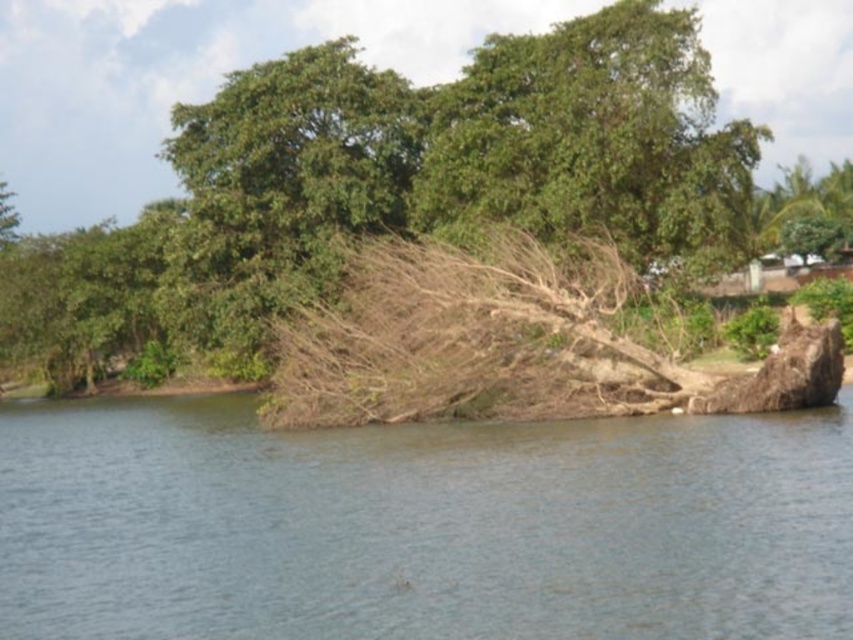
Does brown/dry wood tree at center have a smaller size compared to green leafy tree at upper right?

Incorrect, brown/dry wood tree at center is not smaller in size than green leafy tree at upper right.

Consider the image. Does brown/dry wood tree at center have a lesser height compared to green leafy tree at upper right?

→ No, brown/dry wood tree at center is not shorter than green leafy tree at upper right.

Between point (323, 74) and point (838, 166), which one is positioned in front?

Point (323, 74) is more forward.

Where is `brown/dry wood tree at center`? The height and width of the screenshot is (640, 853). brown/dry wood tree at center is located at coordinates (389, 189).

Is brown dirt at center bigger than green leafy tree at upper right?

Incorrect, brown dirt at center is not larger than green leafy tree at upper right.

Is brown dirt at center taller than green leafy tree at upper right?

No.

What do you see at coordinates (421, 524) in the screenshot? I see `brown dirt at center` at bounding box center [421, 524].

Where is `brown dirt at center`? This screenshot has height=640, width=853. brown dirt at center is located at coordinates (421, 524).

Can you confirm if brown dirt at center is positioned above green leafy tree at upper left?

Incorrect, brown dirt at center is not positioned above green leafy tree at upper left.

Between brown dirt at center and green leafy tree at upper left, which one has less height?

Standing shorter between the two is brown dirt at center.

Between point (219, 477) and point (247, 125), which one is positioned in front?

Point (219, 477)

Locate an element on the screen. The width and height of the screenshot is (853, 640). brown dirt at center is located at coordinates (421, 524).